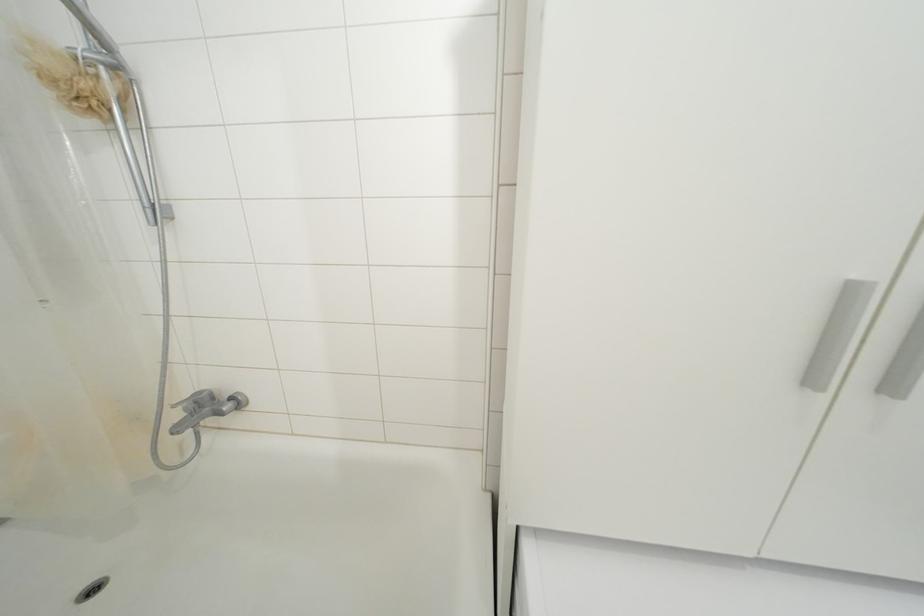
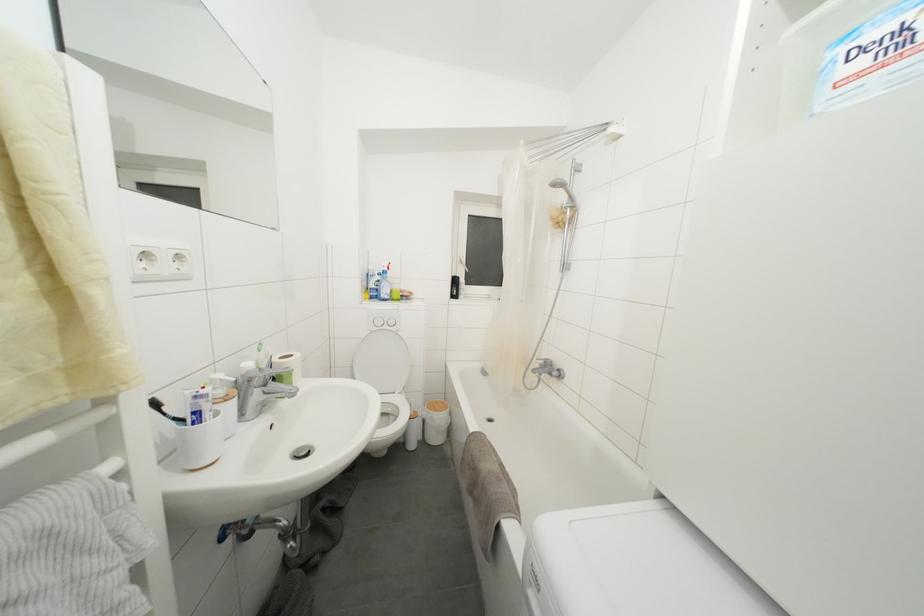
Question: How did the camera likely rotate?

Choices:
 (A) Left
 (B) Right
 (C) Up
 (D) Down

Answer: (A)